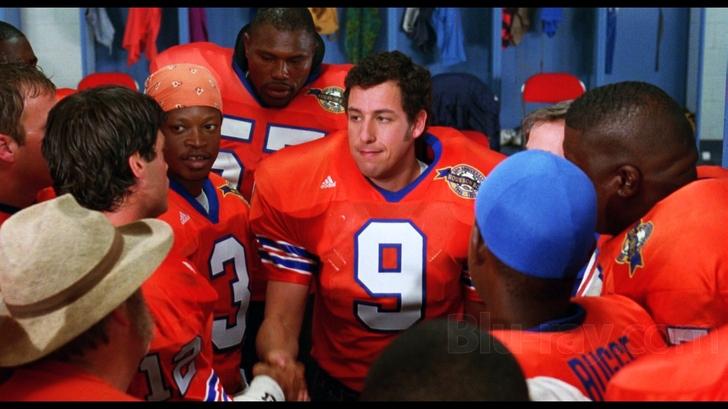
Locate an element on the screen. clothes hanging in locker is located at coordinates click(148, 13), click(97, 15), click(194, 26), click(317, 14), click(354, 14), click(434, 14), click(507, 26), click(547, 18).